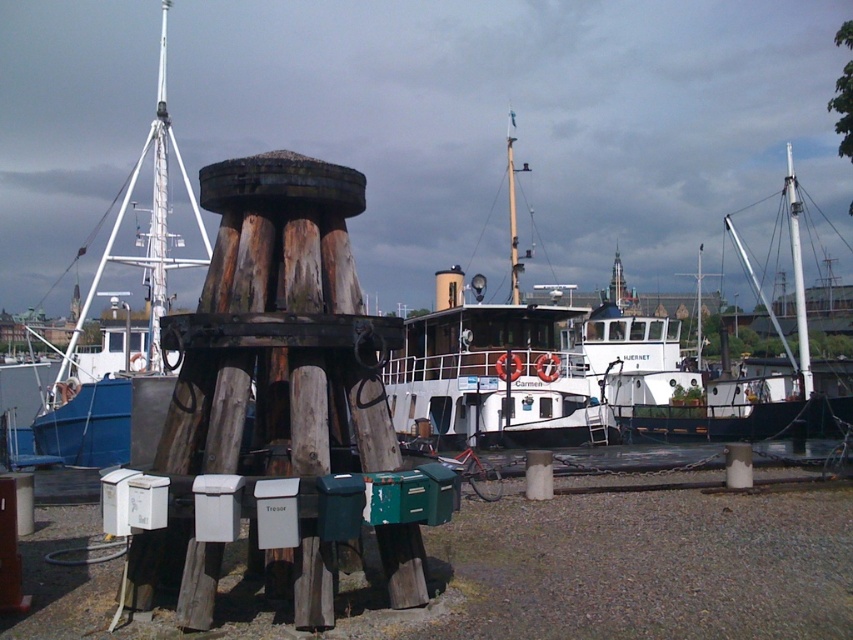
Can you confirm if blue painted wood boat at left is positioned above white wooden boat at center?

Yes, blue painted wood boat at left is above white wooden boat at center.

Between point (132, 356) and point (734, 232), which one is positioned behind?

Point (734, 232)

Identify the location of blue painted wood boat at left. The image size is (853, 640). (126, 326).

Does white matte boat at center have a greater width compared to white wooden boat at center?

In fact, white matte boat at center might be narrower than white wooden boat at center.

Is white matte boat at center below white wooden boat at center?

Yes, white matte boat at center is below white wooden boat at center.

The width and height of the screenshot is (853, 640). What do you see at coordinates (494, 365) in the screenshot?
I see `white matte boat at center` at bounding box center [494, 365].

You are a GUI agent. You are given a task and a screenshot of the screen. Output one action in this format:
    pyautogui.click(x=<x>, y=<y>)
    Task: Click on the white matte boat at center
    The width and height of the screenshot is (853, 640).
    Given the screenshot: What is the action you would take?
    pyautogui.click(x=494, y=365)

Who is positioned more to the left, white matte boat at center or blue painted wood boat at left?

Positioned to the left is blue painted wood boat at left.

What do you see at coordinates (494, 365) in the screenshot? I see `white matte boat at center` at bounding box center [494, 365].

Locate an element on the screen. white matte boat at center is located at coordinates (494, 365).

You are a GUI agent. You are given a task and a screenshot of the screen. Output one action in this format:
    pyautogui.click(x=<x>, y=<y>)
    Task: Click on the white matte boat at center
    Image resolution: width=853 pixels, height=640 pixels.
    Given the screenshot: What is the action you would take?
    pyautogui.click(x=494, y=365)